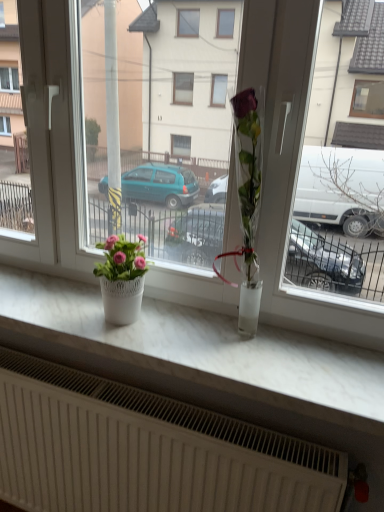
The height and width of the screenshot is (512, 384). I want to click on vacant space situated on the left part of pink matte flower pot at left, so pyautogui.click(x=67, y=308).